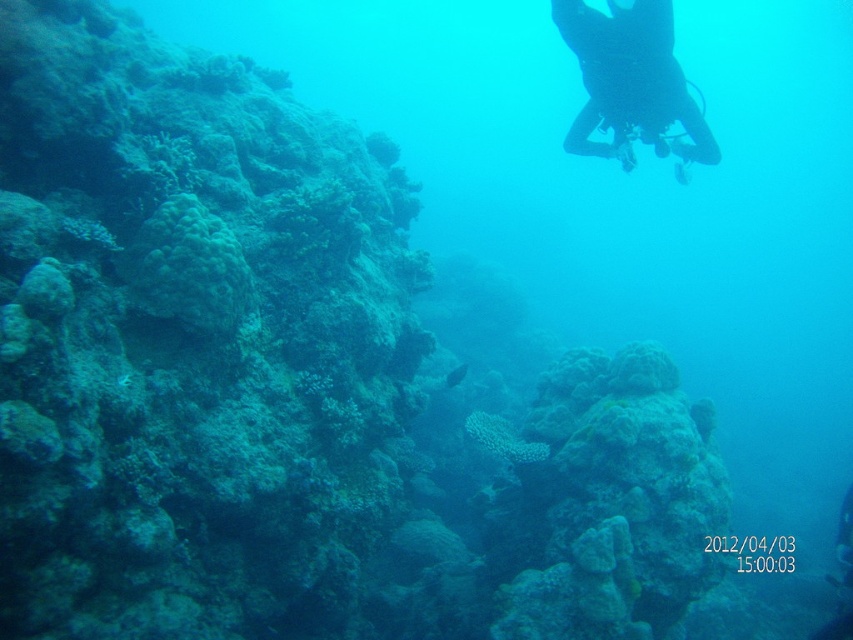
You are a marine biologist observing an underwater scene with a black matte scuba diver at upper center and a green matte coral at left. Which object is bigger?

The black matte scuba diver at upper center is larger in size than the green matte coral at left.

You are a marine biologist planning to place a 0.5 meter long research buoy in the underwater scene. The buoy must be placed at point (630, 81). However, there is already an object at that location. What object is occupying that point?

The black matte scuba diver at upper center is located at point (630, 81), so the object occupying that point is the black matte scuba diver at upper center.

You are a marine biologist observing an underwater scene with a black matte scuba diver at upper center and a green matte coral at left. Based on your observation, is the diver positioned above or below the coral?

The black matte scuba diver at upper center is located above the green matte coral at left.